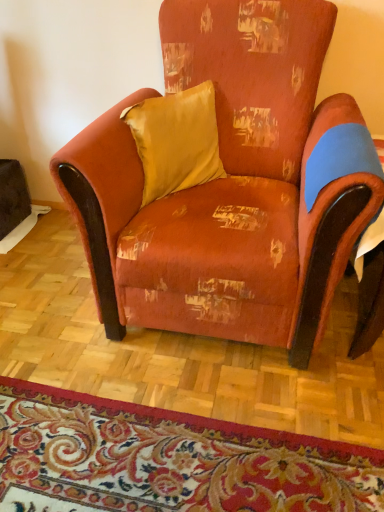
Question: Is distressed orange fabric armchair at center taller or shorter than floral carpet at lower center?

Choices:
 (A) tall
 (B) short

Answer: (A)

Question: From the image's perspective, is distressed orange fabric armchair at center positioned above or below floral carpet at lower center?

Choices:
 (A) below
 (B) above

Answer: (B)

Question: Considering the real-world distances, which object is farthest from the floral carpet at lower center?

Choices:
 (A) distressed orange fabric armchair at center
 (B) satin yellow pillow at upper center

Answer: (B)

Question: Which object is positioned closest to the floral carpet at lower center?

Choices:
 (A) distressed orange fabric armchair at center
 (B) satin yellow pillow at upper center

Answer: (A)